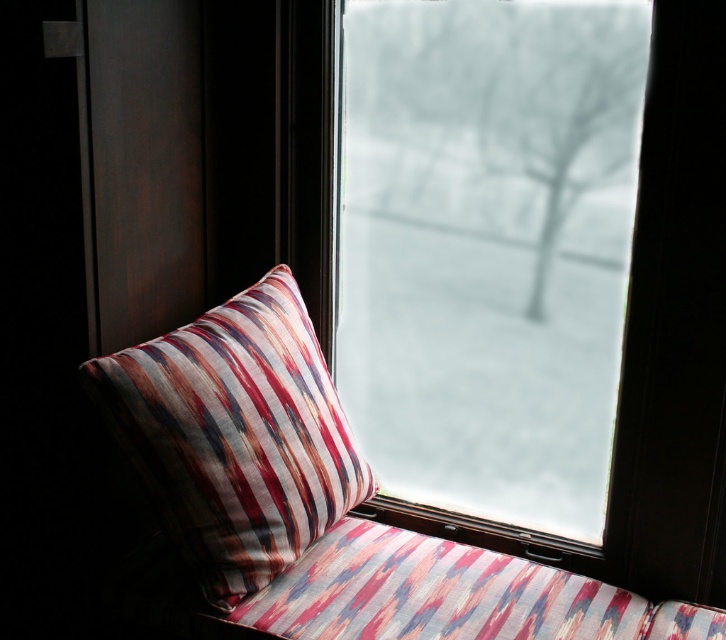
Which is more to the left, transparent glass window at center or striped fabric pillow at center?

Positioned to the left is striped fabric pillow at center.

Where is `transparent glass window at center`? transparent glass window at center is located at coordinates [489, 248].